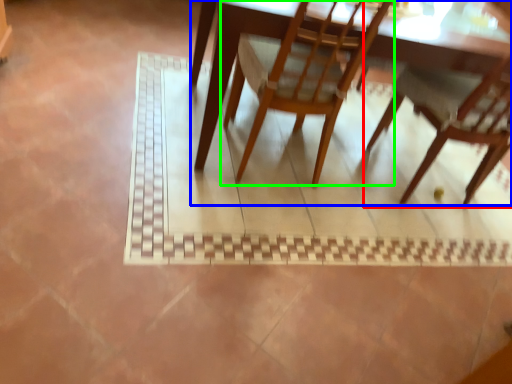
Question: Which is nearer to the chair (highlighted by a red box)? table (highlighted by a blue box) or chair (highlighted by a green box).

Choices:
 (A) table
 (B) chair

Answer: (B)